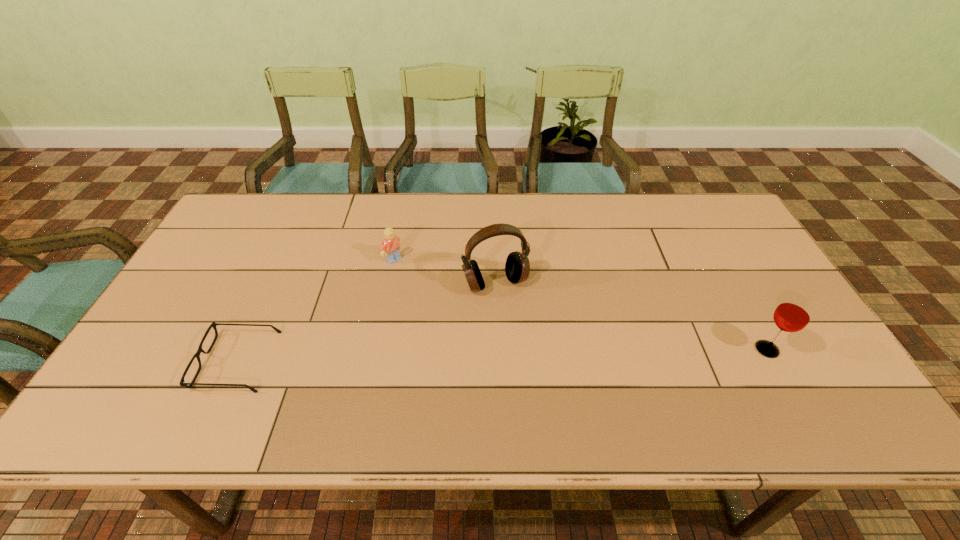
This screenshot has width=960, height=540. In order to click on object located in the near right corner section of the desktop in this screenshot , I will do `click(793, 314)`.

In the image, there is a desktop. Find the location of `vacant space at the far edge`. vacant space at the far edge is located at coordinates (641, 223).

This screenshot has width=960, height=540. I want to click on vacant area at the near edge of the desktop, so click(511, 376).

Identify the location of free point at the left edge. (224, 249).

I want to click on free space at the right edge of the desktop, so click(794, 335).

In the image, there is a desktop. What are the coordinates of `vacant area at the far left corner` in the screenshot? It's located at (245, 227).

Image resolution: width=960 pixels, height=540 pixels. What are the coordinates of `free area in between the farthest object and the second farthest object` in the screenshot? It's located at (444, 271).

Locate an element on the screen. The height and width of the screenshot is (540, 960). unoccupied area between the spectacles and the third object from right to left is located at coordinates (316, 310).

I want to click on free spot between the third tallest object and the headset, so click(444, 271).

The width and height of the screenshot is (960, 540). Find the location of `vacant space that is in between the third nearest object and the glass`. vacant space that is in between the third nearest object and the glass is located at coordinates (631, 316).